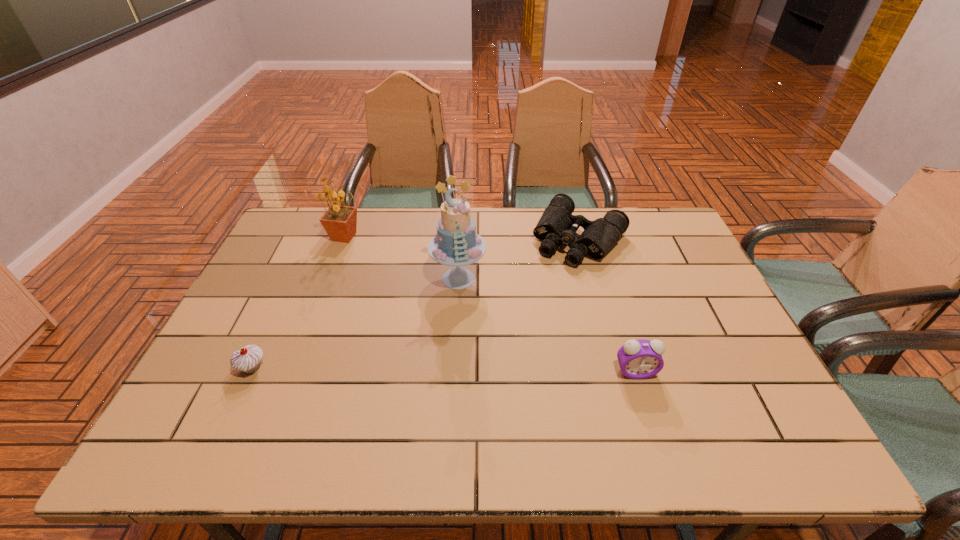
Locate an element on the screen. Image resolution: width=960 pixels, height=540 pixels. free space at the far edge of the desktop is located at coordinates (353, 238).

This screenshot has width=960, height=540. In the image, there is a desktop. Identify the location of blank space at the near edge. (393, 405).

I want to click on vacant space at the left edge, so click(x=290, y=285).

I want to click on vacant space at the right edge of the desktop, so click(710, 339).

Find the location of a particular element. The height and width of the screenshot is (540, 960). free space at the far left corner of the desktop is located at coordinates (298, 233).

Locate an element on the screen. Image resolution: width=960 pixels, height=540 pixels. free region at the far right corner of the desktop is located at coordinates (663, 214).

I want to click on free space between the third object from right to left and the second object from left to right, so click(402, 258).

Identify the location of free space between the alarm clock and the cake. This screenshot has height=540, width=960. (547, 325).

Image resolution: width=960 pixels, height=540 pixels. In order to click on unoccupied area between the alarm clock and the second tallest object in this screenshot , I will do `click(491, 304)`.

At what (x,y) coordinates should I click in order to perform the action: click on vacant space that's between the shortest object and the tallest object. Please return your answer as a coordinate pair (x, y). The image size is (960, 540). Looking at the image, I should click on (519, 259).